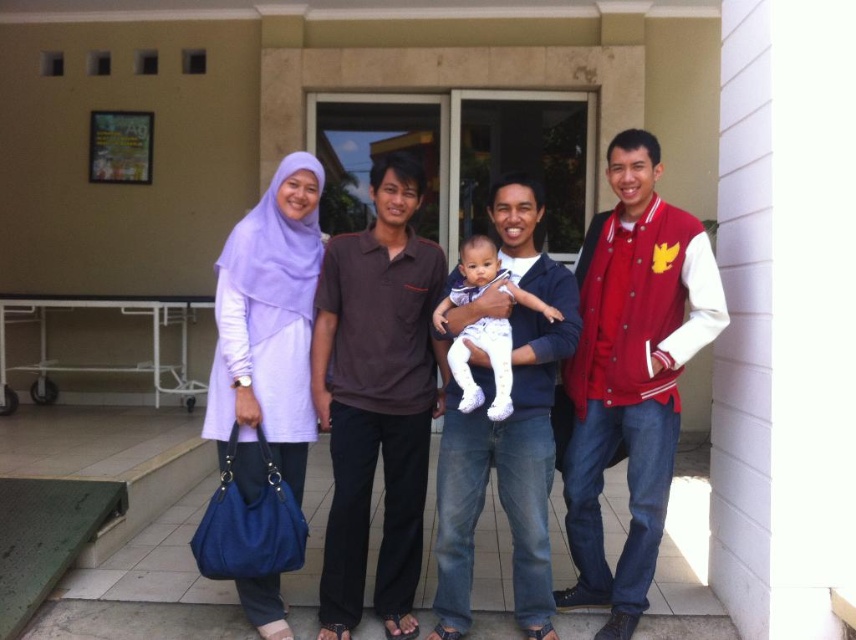
You are a photographer trying to capture a photo of the matte purple hijab at upper left and the white soft baby at center. Which object is positioned to the right side of the other?

The matte purple hijab at upper left is to the right of the white soft baby at center.

From the picture: You are a photographer taking a picture of the matte purple hijab at upper left and the white soft baby at center. Which object is closer to the camera?

The matte purple hijab at upper left is closer to the camera because the white soft baby at center is behind it.